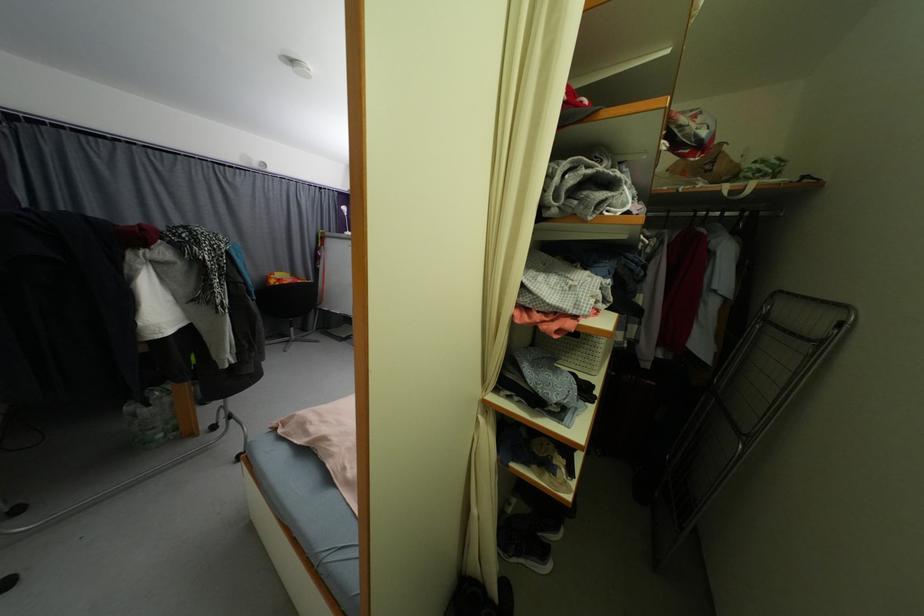
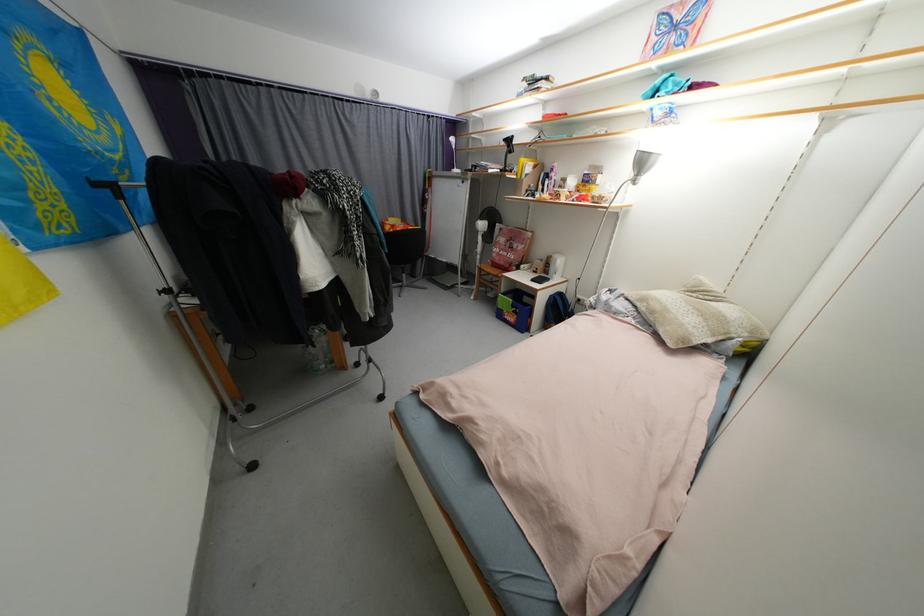
Find the pixel in the second image that matches the point at 165,438 in the first image.

(329, 368)